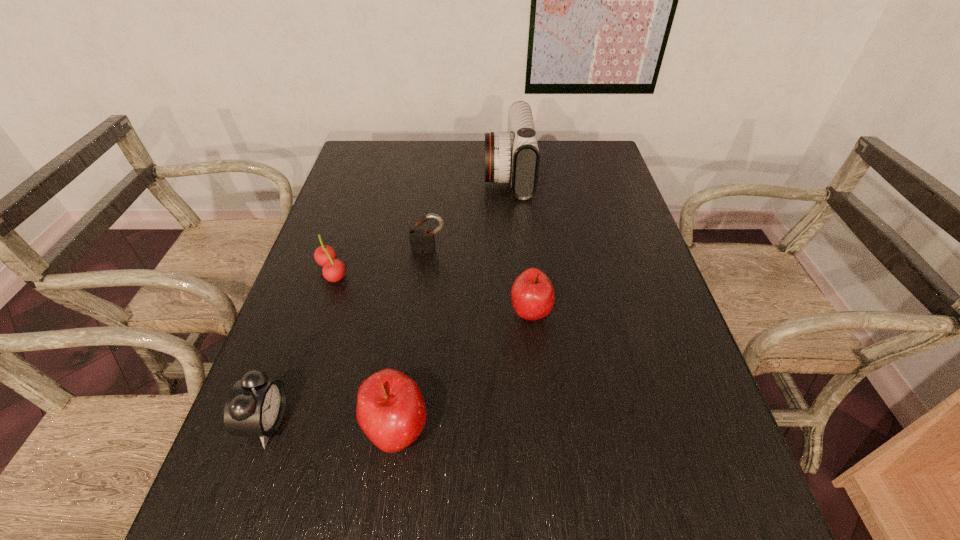
The image size is (960, 540). I want to click on free space between the second farthest object and the alarm clock, so click(x=348, y=336).

Find the location of a particular element. The image size is (960, 540). free space between the second farthest object and the tallest object is located at coordinates (468, 212).

Where is `free space between the padlock and the taller apple`? free space between the padlock and the taller apple is located at coordinates (413, 341).

Locate an element on the screen. vacant space that is in between the nearer apple and the right apple is located at coordinates (464, 372).

Find the location of `vacant area that lies between the left apple and the camcorder`. vacant area that lies between the left apple and the camcorder is located at coordinates (452, 302).

I want to click on free space between the fourth nearest object and the right apple, so [431, 292].

The height and width of the screenshot is (540, 960). Find the location of `vacant point located between the shorter apple and the camcorder`. vacant point located between the shorter apple and the camcorder is located at coordinates (519, 243).

Where is `free area in between the alarm clock and the farthest object`? free area in between the alarm clock and the farthest object is located at coordinates (388, 298).

Where is `vacant area that lies between the alarm clock and the right apple`? This screenshot has width=960, height=540. vacant area that lies between the alarm clock and the right apple is located at coordinates (398, 367).

The width and height of the screenshot is (960, 540). Identify the location of free spot between the left apple and the fourth nearest object. (364, 352).